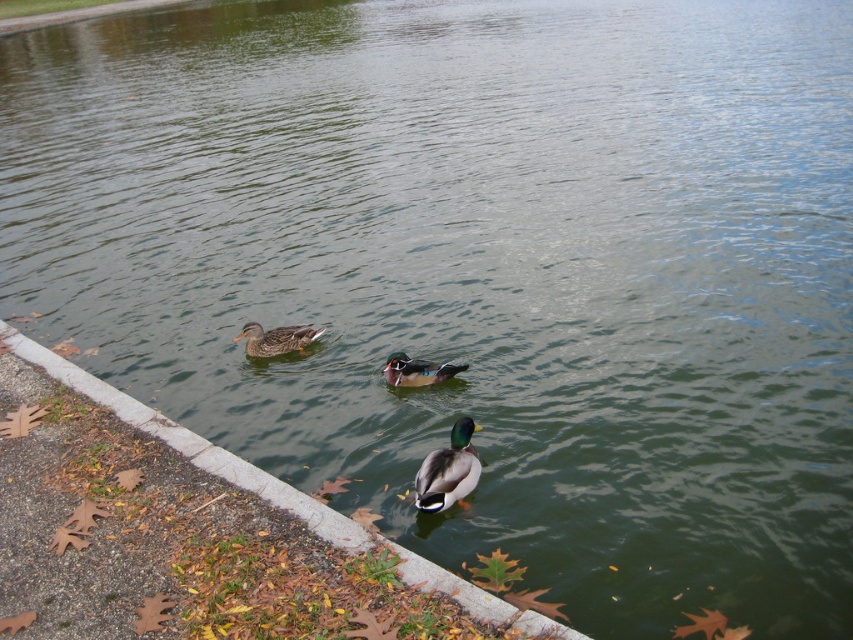
Question: Where is gray concrete curb at lower left located in relation to shiny brown wood duck at center in the image?

Choices:
 (A) left
 (B) right

Answer: (A)

Question: Based on their relative distances, which object is nearer to the green iridescent duck at center?

Choices:
 (A) green glossy duck at center
 (B) gray concrete curb at lower left

Answer: (B)

Question: Does gray concrete curb at lower left have a lesser width compared to shiny brown wood duck at center?

Choices:
 (A) no
 (B) yes

Answer: (A)

Question: Which is farther from the shiny brown wood duck at center?

Choices:
 (A) green glossy duck at center
 (B) gray concrete curb at lower left

Answer: (B)

Question: In this image, where is green iridescent duck at center located relative to green glossy duck at center?

Choices:
 (A) left
 (B) right

Answer: (B)

Question: Based on their relative distances, which object is farther from the gray concrete curb at lower left?

Choices:
 (A) green glossy duck at center
 (B) shiny brown wood duck at center

Answer: (B)